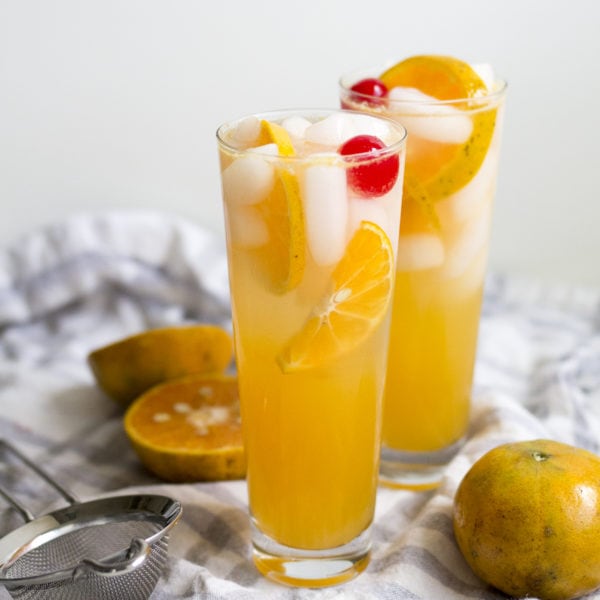
The width and height of the screenshot is (600, 600). In order to click on tea towel in this screenshot , I will do `click(418, 546)`.